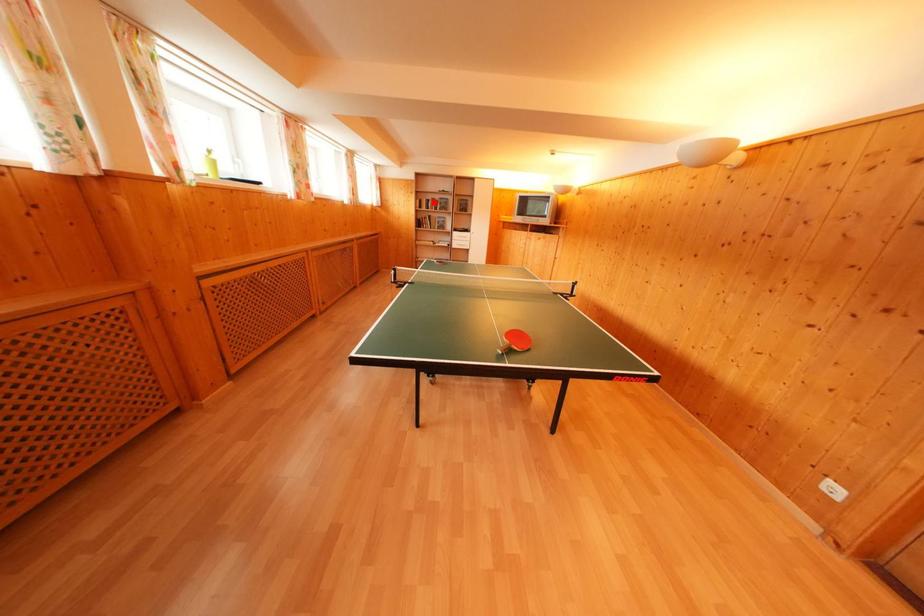
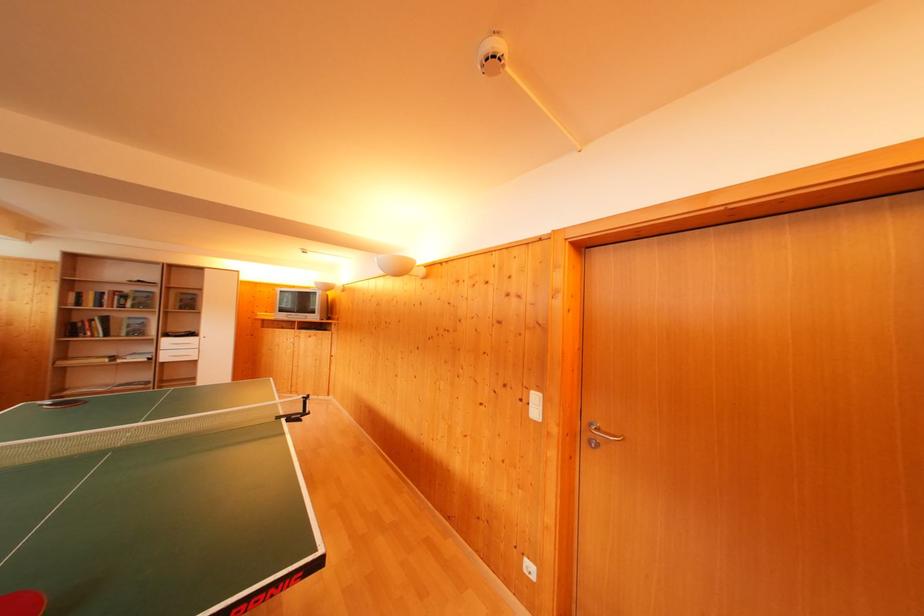
Where in the second image is the point corresponding to the highlighted location from the first image?

(112, 294)